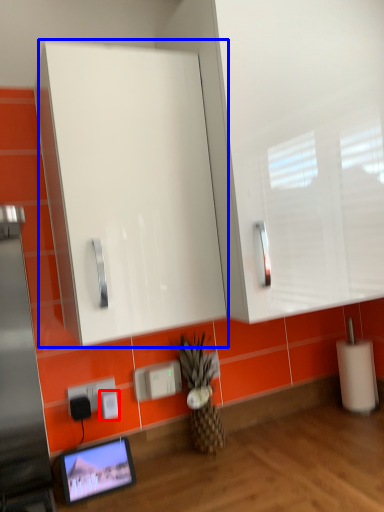
Question: Which of the following is the farthest to the observer, electric outlet (highlighted by a red box) or glass door (highlighted by a blue box)?

Choices:
 (A) electric outlet
 (B) glass door

Answer: (A)